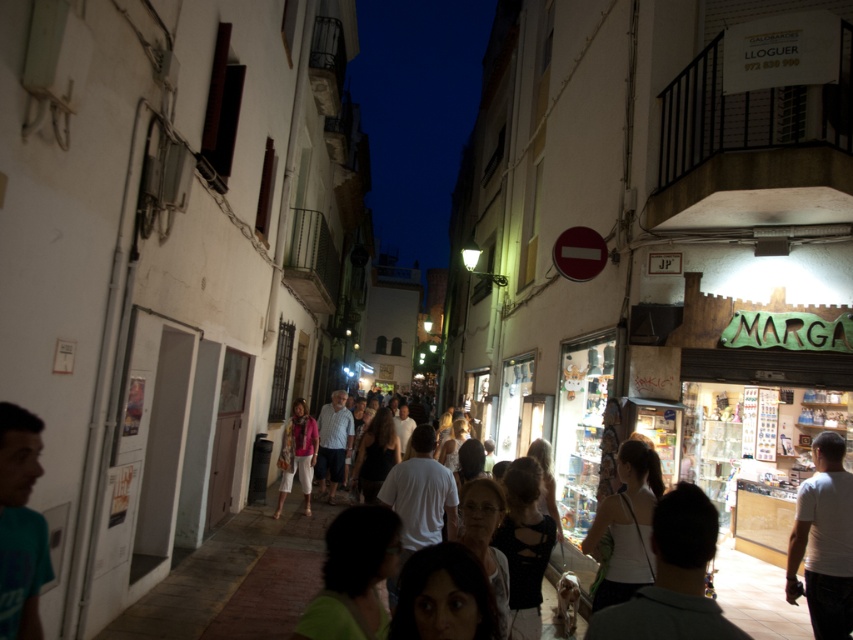
Is white matte shirt at right bigger than white matte tank top at center?

Actually, white matte shirt at right might be smaller than white matte tank top at center.

Does white matte shirt at right have a lesser width compared to white matte tank top at center?

Correct, white matte shirt at right's width is less than white matte tank top at center's.

Is point (811, 486) closer to camera compared to point (637, 576)?

That is False.

Identify the location of white matte shirt at right. The image size is (853, 640). (824, 540).

Between white matte tank top at center and matte pink sweater at center, which one appears on the right side from the viewer's perspective?

Positioned to the right is white matte tank top at center.

Can you confirm if white matte tank top at center is positioned below matte pink sweater at center?

Actually, white matte tank top at center is above matte pink sweater at center.

Between point (624, 502) and point (292, 422), which one is positioned behind?

The point (292, 422) is more distant.

Identify the location of white matte tank top at center. (627, 524).

Does white matte shirt at right have a smaller size compared to matte pink sweater at center?

Indeed, white matte shirt at right has a smaller size compared to matte pink sweater at center.

Is white matte shirt at right in front of matte pink sweater at center?

Yes, it is in front of matte pink sweater at center.

Between point (850, 589) and point (297, 451), which one is positioned behind?

The point (297, 451) is more distant.

You are a GUI agent. You are given a task and a screenshot of the screen. Output one action in this format:
    pyautogui.click(x=<x>, y=<y>)
    Task: Click on the white matte shirt at right
    This screenshot has width=853, height=640.
    Given the screenshot: What is the action you would take?
    pyautogui.click(x=824, y=540)